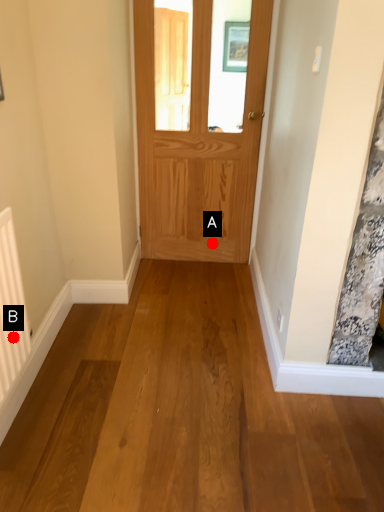
Question: Two points are circled on the image, labeled by A and B beside each circle. Which point is farther to the camera?

Choices:
 (A) A is further
 (B) B is further

Answer: (A)